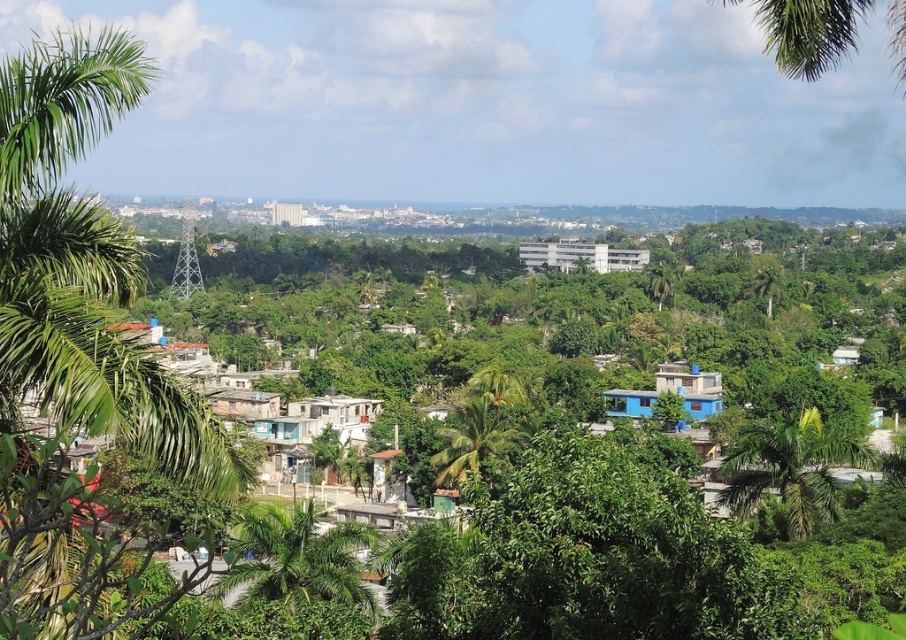
Question: Does green leafy palm tree at left appear over green leafy palm tree at upper right?

Choices:
 (A) no
 (B) yes

Answer: (B)

Question: Based on their relative distances, which object is farther from the green leafy palm tree at center?

Choices:
 (A) green leafy palm tree at lower right
 (B) green leafy palm tree at upper right
 (C) green leafy palm tree at left
 (D) green leafy palm tree at lower center

Answer: (B)

Question: Can you confirm if green leafy palm tree at lower center is positioned to the right of green leafy palm tree at lower right?

Choices:
 (A) no
 (B) yes

Answer: (A)

Question: Which object appears farthest from the camera in this image?

Choices:
 (A) green leafy palm tree at lower right
 (B) green leafy palm tree at center
 (C) green leafy palm tree at upper right

Answer: (C)

Question: Which of these objects is positioned farthest from the green leafy palm tree at upper right?

Choices:
 (A) green leafy palm tree at center
 (B) green leafy palm tree at lower center
 (C) green leafy palm tree at lower right

Answer: (B)

Question: Can you confirm if green leafy palm tree at left is positioned below green leafy palm tree at upper right?

Choices:
 (A) no
 (B) yes

Answer: (A)